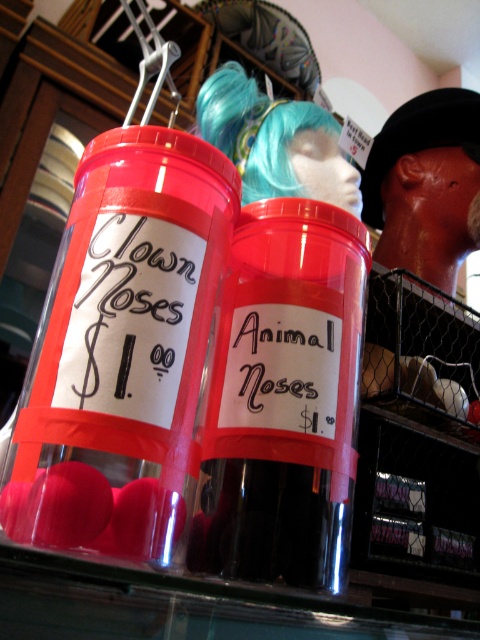
Question: Can you confirm if matte plastic clown nose at left is positioned to the right of transparent plastic container at center?

Choices:
 (A) yes
 (B) no

Answer: (B)

Question: Does matte plastic clown nose at left have a larger size compared to transparent plastic container at center?

Choices:
 (A) no
 (B) yes

Answer: (B)

Question: Is matte plastic clown nose at left wider than transparent plastic container at center?

Choices:
 (A) no
 (B) yes

Answer: (B)

Question: Which point is farther to the camera?

Choices:
 (A) matte plastic clown nose at left
 (B) transparent plastic container at center

Answer: (B)

Question: Which object is farther from the camera taking this photo?

Choices:
 (A) transparent plastic container at center
 (B) matte plastic clown nose at left

Answer: (A)